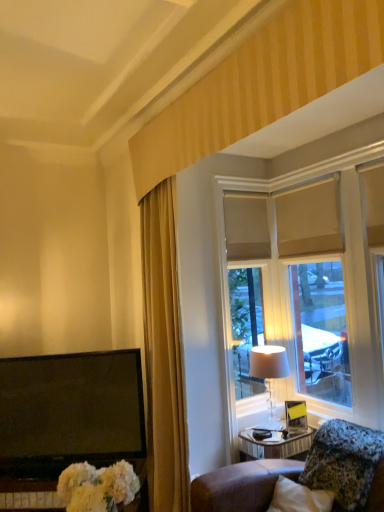
Question: Does granite-like stone pillow at lower right have a smaller size compared to gold fabric curtain at left?

Choices:
 (A) yes
 (B) no

Answer: (A)

Question: Can you confirm if granite-like stone pillow at lower right is thinner than gold fabric curtain at left?

Choices:
 (A) no
 (B) yes

Answer: (A)

Question: Is the position of granite-like stone pillow at lower right more distant than that of gold fabric curtain at left?

Choices:
 (A) yes
 (B) no

Answer: (B)

Question: Is granite-like stone pillow at lower right in contact with gold fabric curtain at left?

Choices:
 (A) yes
 (B) no

Answer: (B)

Question: Does granite-like stone pillow at lower right have a greater height compared to gold fabric curtain at left?

Choices:
 (A) no
 (B) yes

Answer: (A)

Question: Is granite-like stone pillow at lower right facing towards gold fabric curtain at left?

Choices:
 (A) yes
 (B) no

Answer: (B)

Question: Is gold fabric curtain at left further to camera compared to matte beige lampshade at right?

Choices:
 (A) no
 (B) yes

Answer: (A)

Question: Is gold fabric curtain at left in contact with matte beige lampshade at right?

Choices:
 (A) no
 (B) yes

Answer: (A)

Question: Is there a large distance between gold fabric curtain at left and matte beige lampshade at right?

Choices:
 (A) no
 (B) yes

Answer: (A)

Question: Does gold fabric curtain at left have a smaller size compared to matte beige lampshade at right?

Choices:
 (A) yes
 (B) no

Answer: (B)

Question: From a real-world perspective, is gold fabric curtain at left under matte beige lampshade at right?

Choices:
 (A) yes
 (B) no

Answer: (B)

Question: From the image's perspective, is gold fabric curtain at left under matte beige lampshade at right?

Choices:
 (A) no
 (B) yes

Answer: (A)

Question: Is matte beige lampshade at right smaller than gold fabric curtain at left?

Choices:
 (A) yes
 (B) no

Answer: (A)